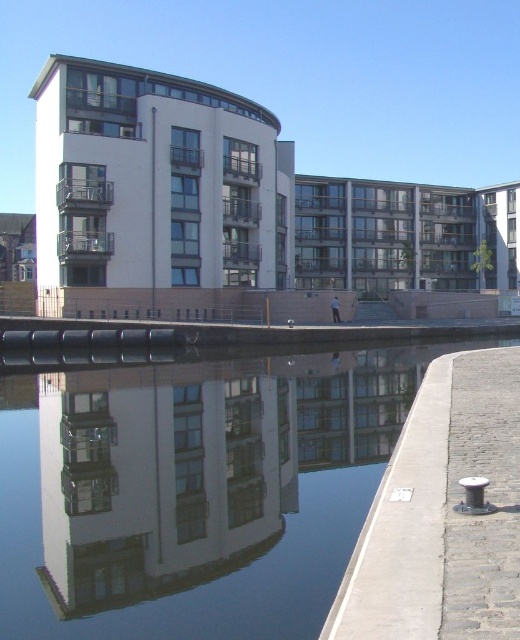
Is concrete at lower right to the left of gray cobblestone pavement at lower right from the viewer's perspective?

Indeed, concrete at lower right is positioned on the left side of gray cobblestone pavement at lower right.

Does point (456, 582) come closer to viewer compared to point (481, 426)?

Yes, it is in front of point (481, 426).

In the scene shown: Who is more forward, (408, 416) or (507, 371)?

Point (408, 416) is more forward.

Locate an element on the screen. This screenshot has height=640, width=520. concrete at lower right is located at coordinates (443, 515).

Is point (29, 624) positioned behind point (514, 592)?

That is True.

Consider the image. Can you confirm if transparent glass canal at lower left is positioned to the right of gray cobblestone pavement at lower right?

In fact, transparent glass canal at lower left is to the left of gray cobblestone pavement at lower right.

Between point (4, 616) and point (451, 369), which one is positioned in front?

Point (4, 616)

Locate an element on the screen. The image size is (520, 640). transparent glass canal at lower left is located at coordinates (192, 490).

Where is `transparent glass canal at lower left`? transparent glass canal at lower left is located at coordinates (192, 490).

The height and width of the screenshot is (640, 520). Describe the element at coordinates (192, 490) in the screenshot. I see `transparent glass canal at lower left` at that location.

Image resolution: width=520 pixels, height=640 pixels. I want to click on transparent glass canal at lower left, so click(x=192, y=490).